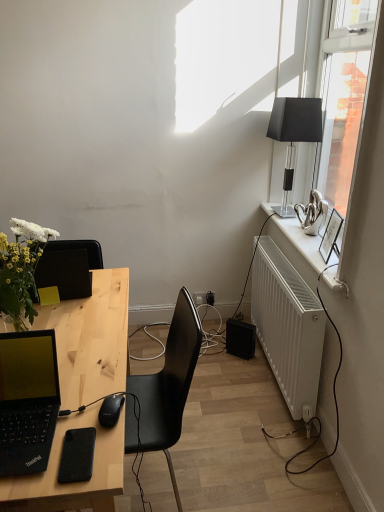
Find the location of a particular element. free space to the left of black matte mouse at lower left is located at coordinates [62, 414].